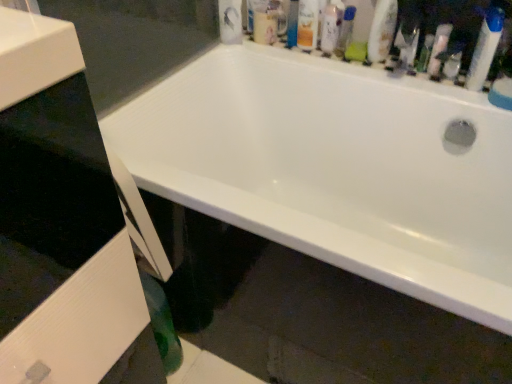
Question: Can you confirm if translucent plastic spray bottle at upper right, which is counted as the 1th cleaning product, starting from the right, is positioned to the left of green plastic mouthwash at upper center, the 1th mouthwash from the right?

Choices:
 (A) no
 (B) yes

Answer: (A)

Question: Would you say translucent plastic spray bottle at upper right, which appears as the 2th cleaning product when viewed from the left, is outside green plastic mouthwash at upper center, which is counted as the third mouthwash, starting from the left?

Choices:
 (A) yes
 (B) no

Answer: (A)

Question: From a real-world perspective, does translucent plastic spray bottle at upper right, which appears as the 2th cleaning product when viewed from the left, stand above green plastic mouthwash at upper center, the 1th mouthwash from the right?

Choices:
 (A) yes
 (B) no

Answer: (B)

Question: From the image's perspective, is translucent plastic spray bottle at upper right, which appears as the 2th cleaning product when viewed from the left, below green plastic mouthwash at upper center, which is counted as the third mouthwash, starting from the left?

Choices:
 (A) yes
 (B) no

Answer: (A)

Question: Is translucent plastic spray bottle at upper right, which is counted as the 1th cleaning product, starting from the right, bigger than green plastic mouthwash at upper center, the 1th mouthwash from the right?

Choices:
 (A) yes
 (B) no

Answer: (B)

Question: Is translucent plastic spray bottle at upper right, which is counted as the 1th cleaning product, starting from the right, turned away from green plastic mouthwash at upper center, which is counted as the third mouthwash, starting from the left?

Choices:
 (A) yes
 (B) no

Answer: (B)

Question: Can matte orange can at upper center, the 4th toiletry viewed from the right, be found inside white plastic mouthwash at upper center, which appears as the first mouthwash when viewed from the left?

Choices:
 (A) yes
 (B) no

Answer: (B)

Question: From a real-world perspective, is white plastic mouthwash at upper center, which appears as the first mouthwash when viewed from the left, positioned over matte orange can at upper center, the 4th toiletry viewed from the right, based on gravity?

Choices:
 (A) yes
 (B) no

Answer: (A)

Question: From the image's perspective, would you say white plastic mouthwash at upper center, which is counted as the 3th mouthwash, starting from the right, is shown under matte orange can at upper center, the 4th toiletry viewed from the right?

Choices:
 (A) yes
 (B) no

Answer: (B)

Question: Can you confirm if white plastic mouthwash at upper center, which is counted as the 3th mouthwash, starting from the right, is bigger than matte orange can at upper center, which ranks as the first toiletry in left-to-right order?

Choices:
 (A) yes
 (B) no

Answer: (B)

Question: Considering the relative sizes of white plastic mouthwash at upper center, which is counted as the 3th mouthwash, starting from the right, and matte orange can at upper center, which ranks as the first toiletry in left-to-right order, in the image provided, is white plastic mouthwash at upper center, which is counted as the 3th mouthwash, starting from the right, thinner than matte orange can at upper center, which ranks as the first toiletry in left-to-right order,?

Choices:
 (A) no
 (B) yes

Answer: (B)

Question: Is white plastic mouthwash at upper center, which is counted as the 3th mouthwash, starting from the right, facing away from matte orange can at upper center, which ranks as the first toiletry in left-to-right order?

Choices:
 (A) no
 (B) yes

Answer: (A)

Question: From the image's perspective, is green plastic mouthwash at upper center, which is counted as the third mouthwash, starting from the left, above translucent plastic spray bottle at upper right, which is counted as the 1th cleaning product, starting from the right?

Choices:
 (A) yes
 (B) no

Answer: (A)